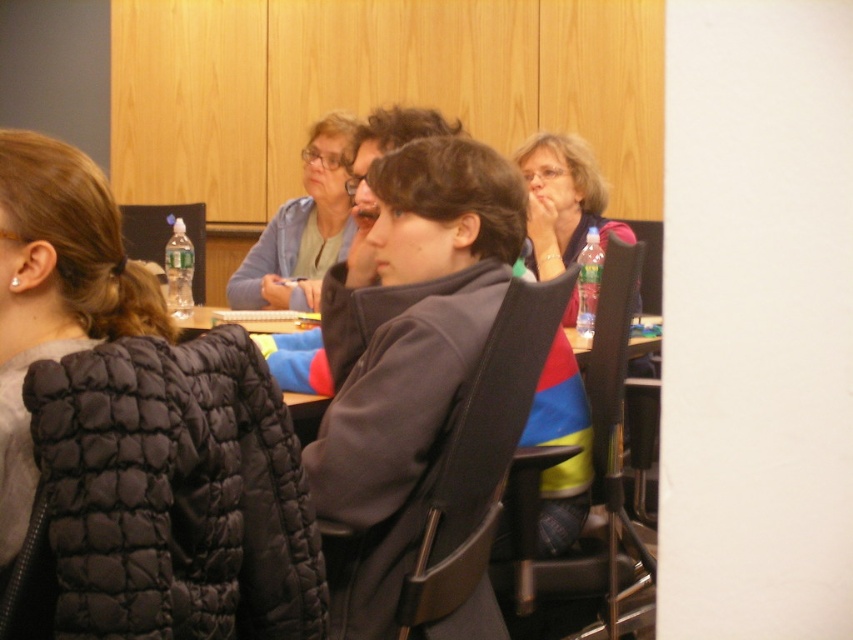
Based on the photo, does black quilted jacket at lower left have a lesser height compared to matte blue sweater at upper center?

Correct, black quilted jacket at lower left is not as tall as matte blue sweater at upper center.

Does black quilted jacket at lower left have a smaller size compared to matte blue sweater at upper center?

Yes, black quilted jacket at lower left is smaller than matte blue sweater at upper center.

Locate an element on the screen. The height and width of the screenshot is (640, 853). black quilted jacket at lower left is located at coordinates (169, 497).

Where is `black quilted jacket at lower left`? This screenshot has width=853, height=640. black quilted jacket at lower left is located at coordinates (169, 497).

Is black quilted jacket at lower left positioned before clear plastic bottle at upper left?

Yes.

Is black quilted jacket at lower left shorter than clear plastic bottle at upper left?

Yes, black quilted jacket at lower left is shorter than clear plastic bottle at upper left.

Between point (200, 468) and point (190, 221), which one is positioned in front?

Point (200, 468) is in front.

Where is `black quilted jacket at lower left`? The width and height of the screenshot is (853, 640). black quilted jacket at lower left is located at coordinates (169, 497).

Who is higher up, black plastic chair at center or polyester flag at center?

black plastic chair at center

Between black plastic chair at center and polyester flag at center, which one appears on the right side from the viewer's perspective?

From the viewer's perspective, polyester flag at center appears more on the right side.

This screenshot has width=853, height=640. I want to click on black plastic chair at center, so click(x=390, y=426).